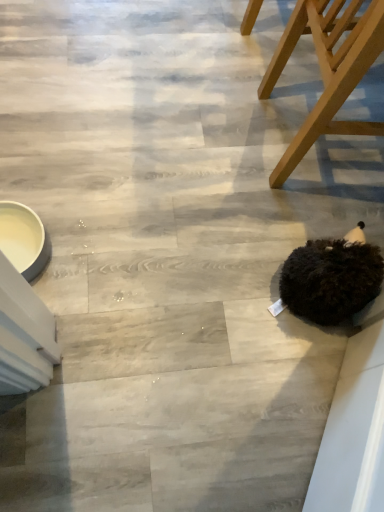
Question: In terms of width, does black fuzzy ball at lower right look wider or thinner when compared to wooden chair at upper right?

Choices:
 (A) thin
 (B) wide

Answer: (A)

Question: Considering the positions of black fuzzy ball at lower right and wooden chair at upper right in the image, is black fuzzy ball at lower right bigger or smaller than wooden chair at upper right?

Choices:
 (A) small
 (B) big

Answer: (A)

Question: Is black fuzzy ball at lower right to the left or to the right of wooden chair at upper right in the image?

Choices:
 (A) right
 (B) left

Answer: (B)

Question: Considering their positions, is wooden chair at upper right located in front of or behind black fuzzy ball at lower right?

Choices:
 (A) behind
 (B) front

Answer: (B)

Question: Considering the positions of wooden chair at upper right and black fuzzy ball at lower right in the image, is wooden chair at upper right bigger or smaller than black fuzzy ball at lower right?

Choices:
 (A) big
 (B) small

Answer: (A)

Question: Do you think wooden chair at upper right is within black fuzzy ball at lower right, or outside of it?

Choices:
 (A) outside
 (B) inside

Answer: (A)

Question: Considering the positions of wooden chair at upper right and black fuzzy ball at lower right in the image, is wooden chair at upper right taller or shorter than black fuzzy ball at lower right?

Choices:
 (A) tall
 (B) short

Answer: (A)